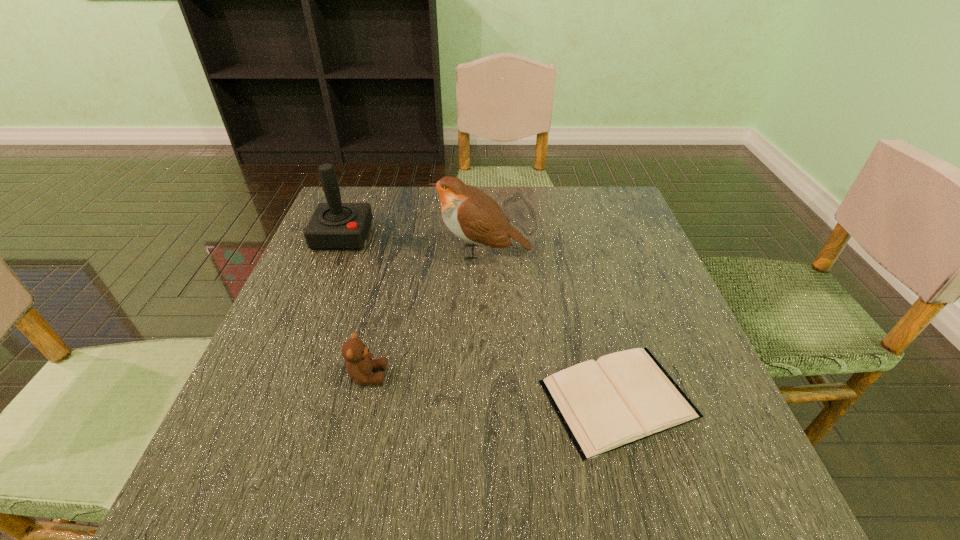
The width and height of the screenshot is (960, 540). Identify the location of bird. (473, 216).

Find the location of a particular element. the leftmost object is located at coordinates pos(333,225).

The image size is (960, 540). I want to click on teddy bear, so click(x=359, y=364).

Where is `the second shortest object`? This screenshot has height=540, width=960. the second shortest object is located at coordinates (359, 364).

Identify the location of the shortest object. (627, 396).

The image size is (960, 540). I want to click on vacant space located 0.240m at the face of the bird, so 335,252.

Where is `vacant area located at the face of the bird`? vacant area located at the face of the bird is located at coordinates (393, 252).

The height and width of the screenshot is (540, 960). I want to click on vacant space located at the face of the bird, so click(372, 252).

The image size is (960, 540). I want to click on vacant space situated 0.140m on the base of the leftmost object, so click(x=321, y=292).

Where is `free region located 0.070m on the face of the third object from right to left`? This screenshot has width=960, height=540. free region located 0.070m on the face of the third object from right to left is located at coordinates (425, 376).